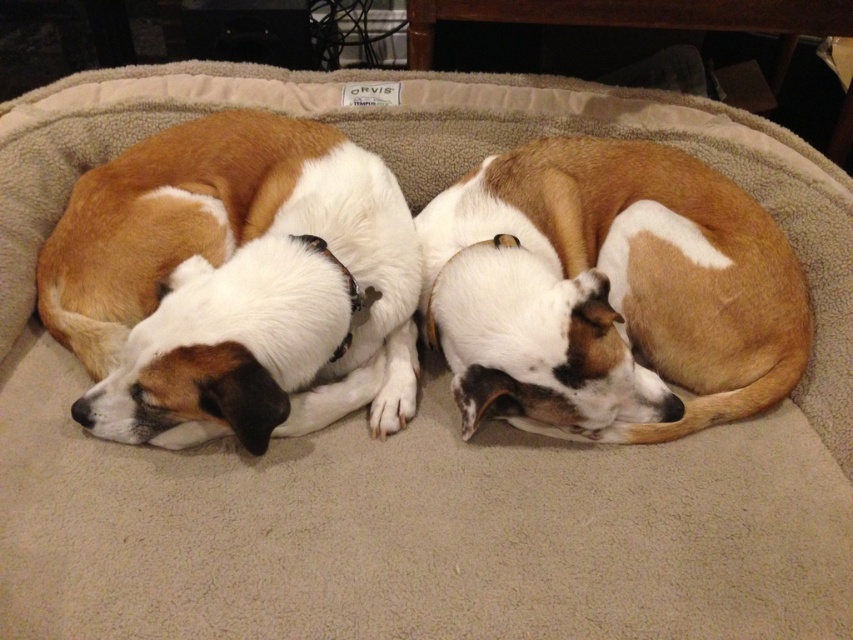
Question: Where is brown and white fur at center located in relation to brown/white fur dog at center in the image?

Choices:
 (A) left
 (B) right

Answer: (A)

Question: Can you confirm if brown and white fur at center is positioned above brown/white fur dog at center?

Choices:
 (A) no
 (B) yes

Answer: (B)

Question: Considering the relative positions of brown and white fur at center and brown/white fur dog at center in the image provided, where is brown and white fur at center located with respect to brown/white fur dog at center?

Choices:
 (A) right
 (B) left

Answer: (B)

Question: Which point is closer to the camera taking this photo?

Choices:
 (A) (520, 230)
 (B) (183, 172)

Answer: (B)

Question: Which object is farther from the camera taking this photo?

Choices:
 (A) brown and white fur at center
 (B) brown/white fur dog at center

Answer: (B)

Question: Which point is closer to the camera taking this photo?

Choices:
 (A) (305, 332)
 (B) (509, 404)

Answer: (A)